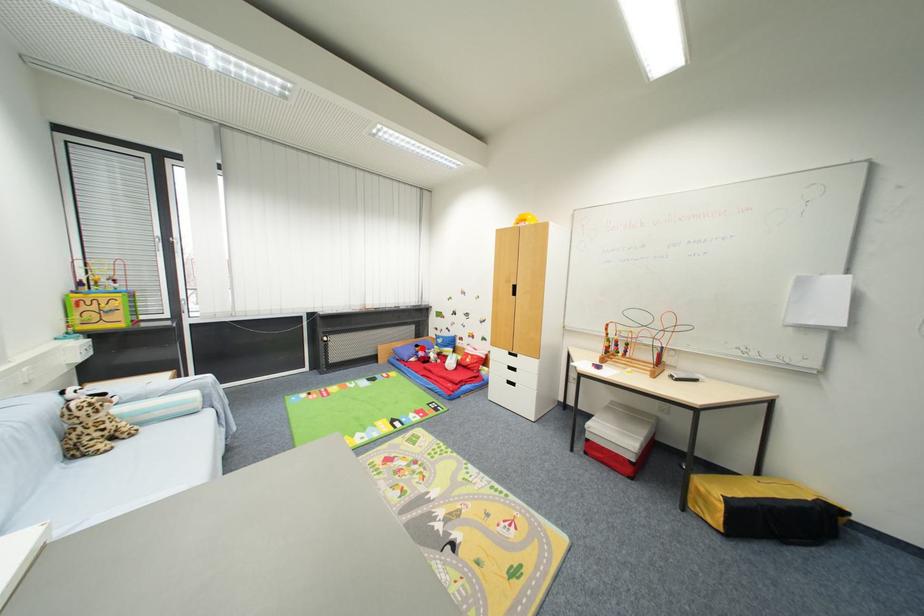
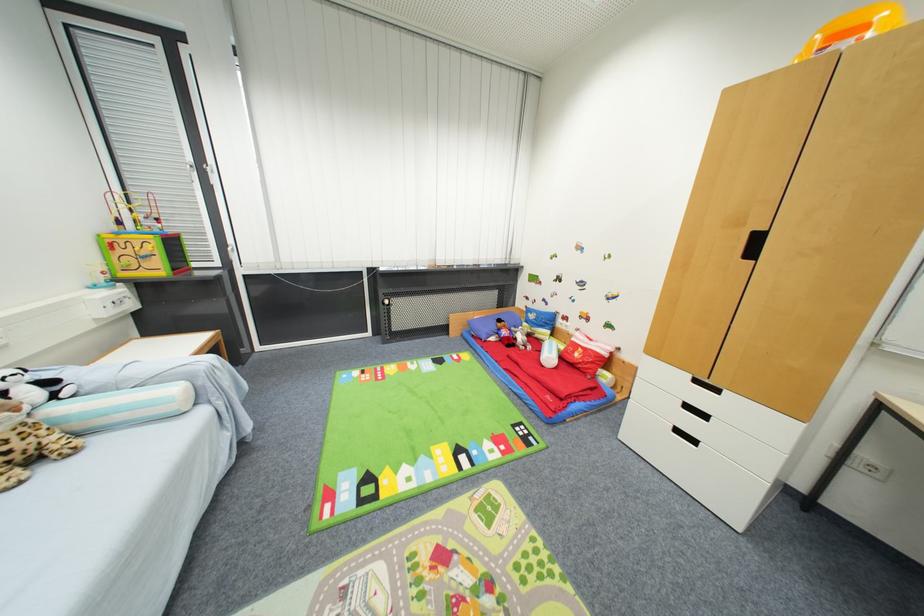
Find the pixel in the second image that matches the highlighted location in the first image.

(505, 323)